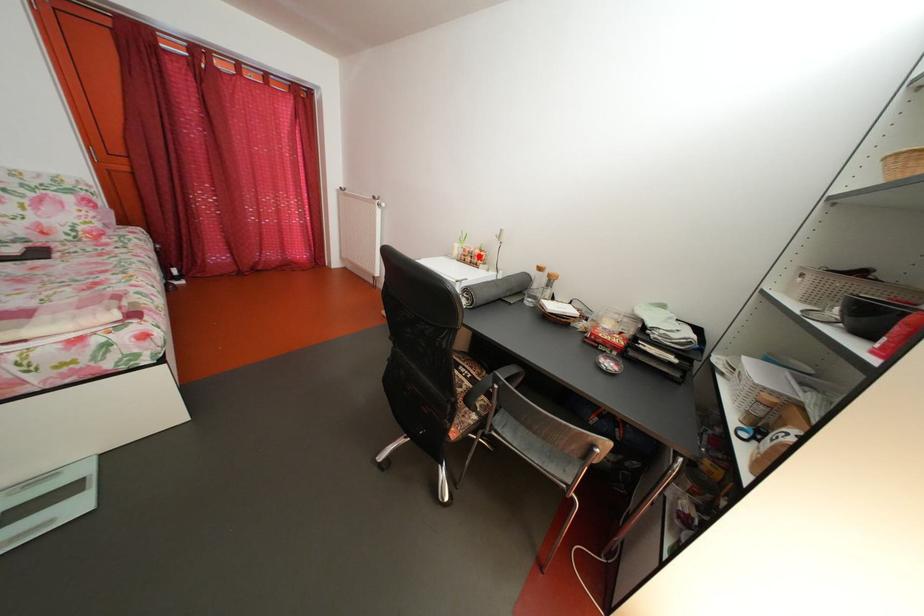
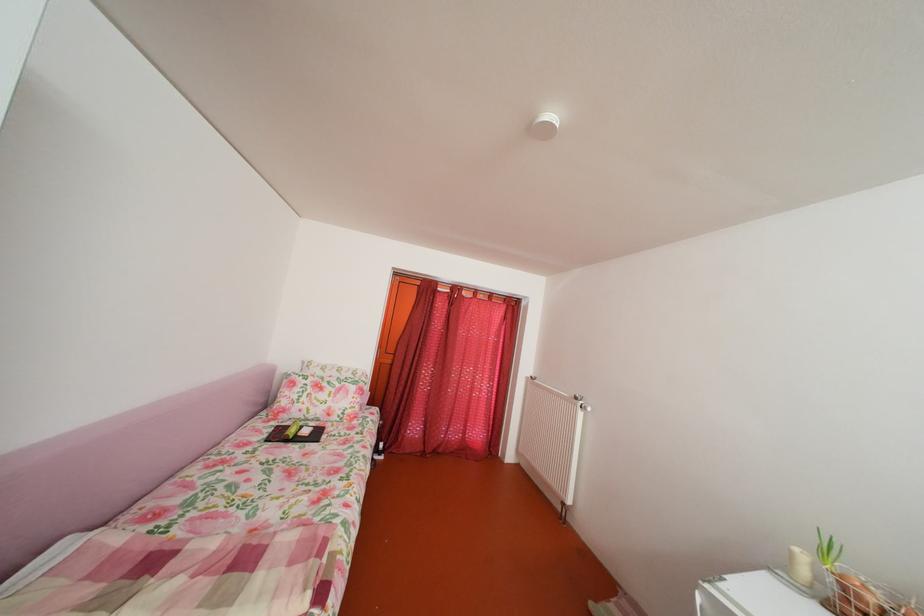
Locate, in the second image, the point that corresponds to the highlighted location in the first image.

(882, 607)